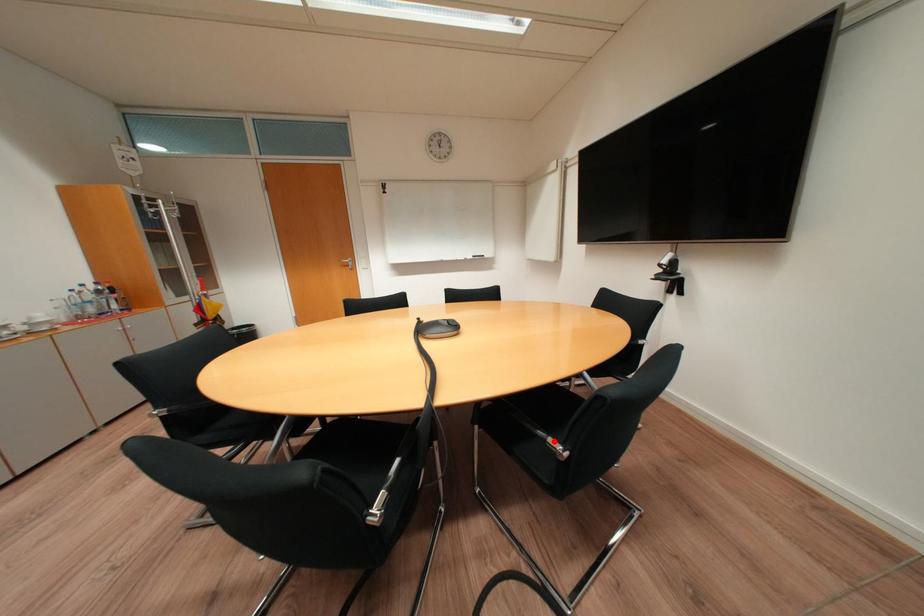
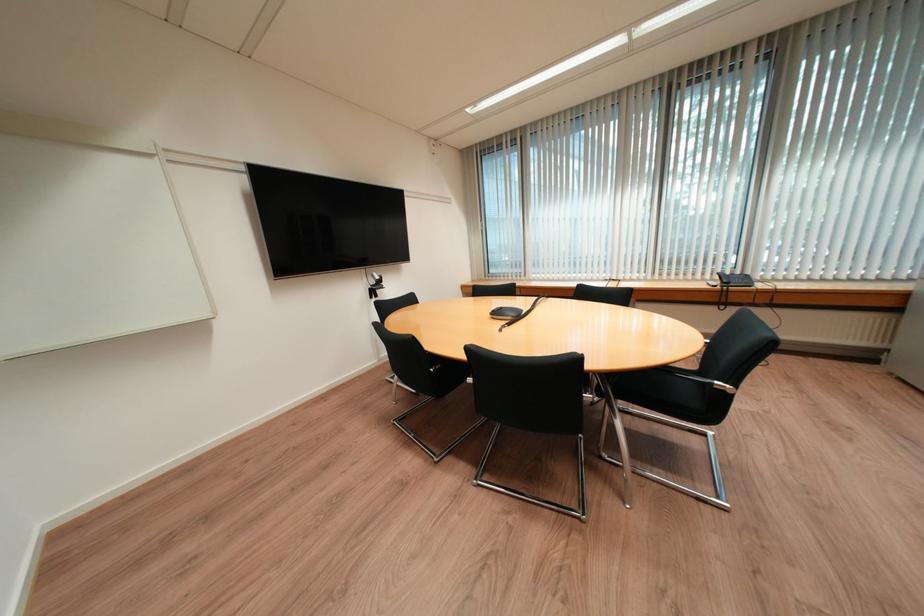
Question: I am providing you with two images of the same scene from different viewpoints. A red point is marked on the first image. Is the red point's position out of view in image 2?

Choices:
 (A) Yes
 (B) No

Answer: (A)